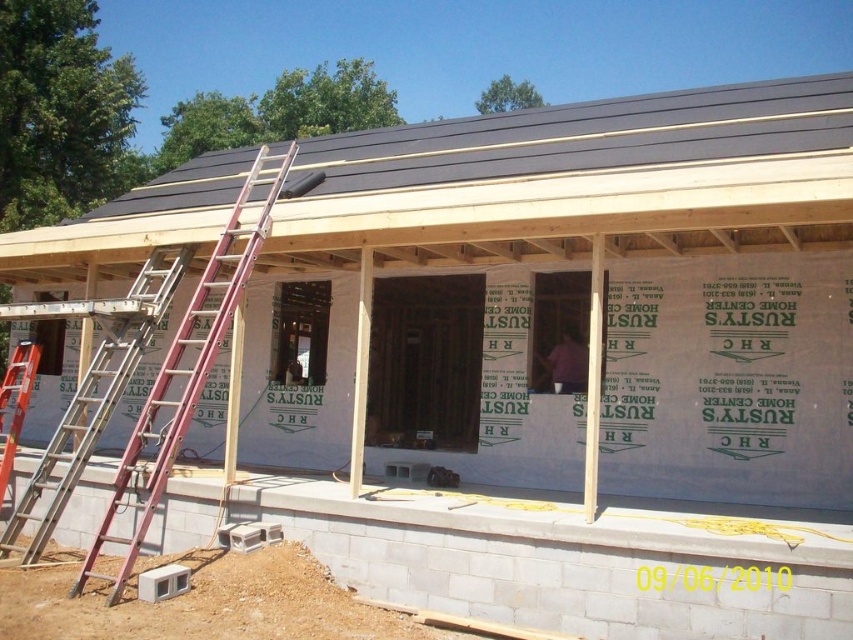
Question: In this image, where is dark gray shingles at upper center located relative to silver metallic ladder at left?

Choices:
 (A) above
 (B) below

Answer: (A)

Question: Which object is positioned farthest from the dark gray shingles at upper center?

Choices:
 (A) silver metallic ladder at left
 (B) white foam insulation at center

Answer: (A)

Question: Is white foam insulation at center wider than metallic silver ladder at left?

Choices:
 (A) yes
 (B) no

Answer: (A)

Question: Which point is farther from the camera taking this photo?

Choices:
 (A) (15, 360)
 (B) (618, 346)
 (C) (212, 284)
 (D) (62, 460)

Answer: (B)

Question: Which object is the closest to the white foam insulation at center?

Choices:
 (A) orange metallic ladder at left
 (B) dark gray shingles at upper center

Answer: (B)

Question: Does white foam insulation at center appear under dark gray shingles at upper center?

Choices:
 (A) no
 (B) yes

Answer: (B)